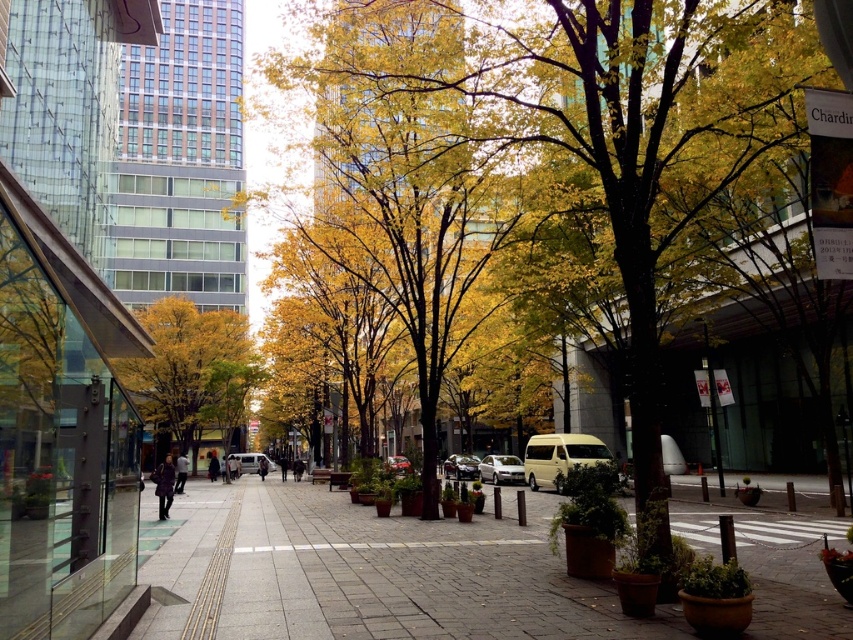
Can you confirm if yellow/golden wood at center is positioned to the left of satin silver van at center?

Correct, you'll find yellow/golden wood at center to the left of satin silver van at center.

In the scene shown: Which is below, yellow/golden wood at center or satin silver van at center?

satin silver van at center

Is point (157, 317) less distant than point (488, 467)?

No, (157, 317) is behind (488, 467).

Where is `yellow/golden wood at center`? yellow/golden wood at center is located at coordinates (192, 369).

Can you confirm if beige matte van at center is positioned to the right of shiny red car at center?

Yes, beige matte van at center is to the right of shiny red car at center.

Does beige matte van at center have a greater height compared to shiny red car at center?

Yes.

The height and width of the screenshot is (640, 853). What do you see at coordinates (560, 458) in the screenshot?
I see `beige matte van at center` at bounding box center [560, 458].

I want to click on beige matte van at center, so click(x=560, y=458).

Who is positioned more to the left, yellow/golden wood at center or matte silver van at center?

Positioned to the left is yellow/golden wood at center.

The image size is (853, 640). Identify the location of yellow/golden wood at center. (192, 369).